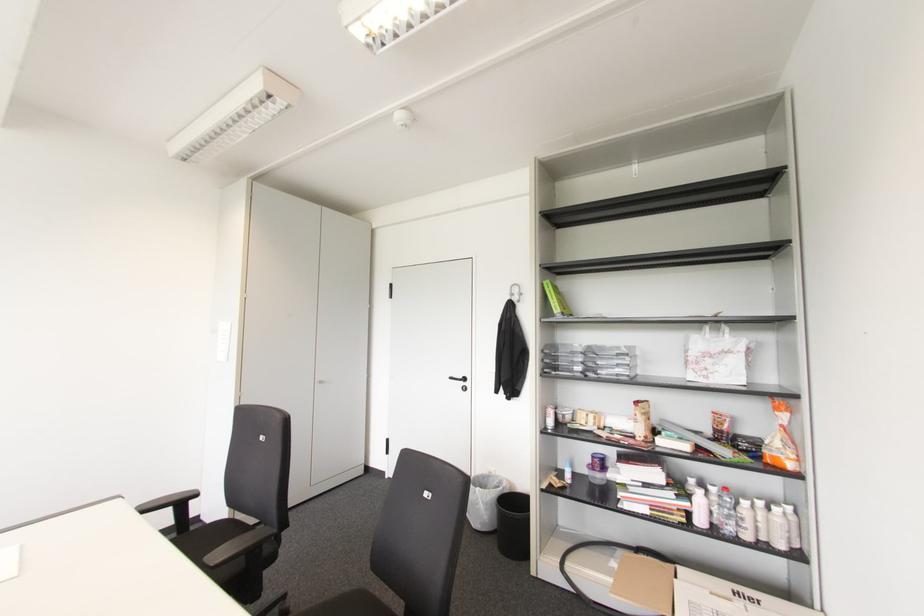
Locate an element on the screen. This screenshot has width=924, height=616. black trash can is located at coordinates (513, 525).